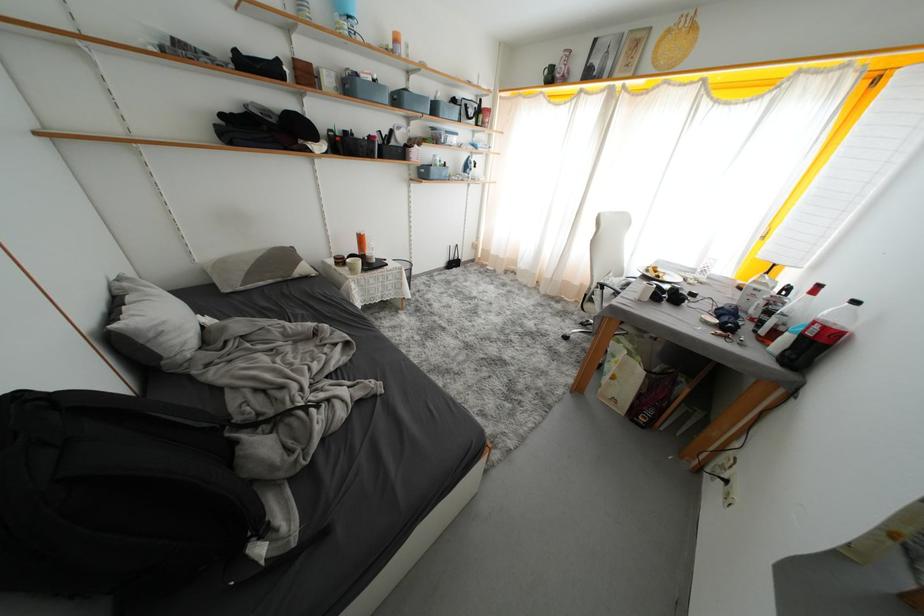
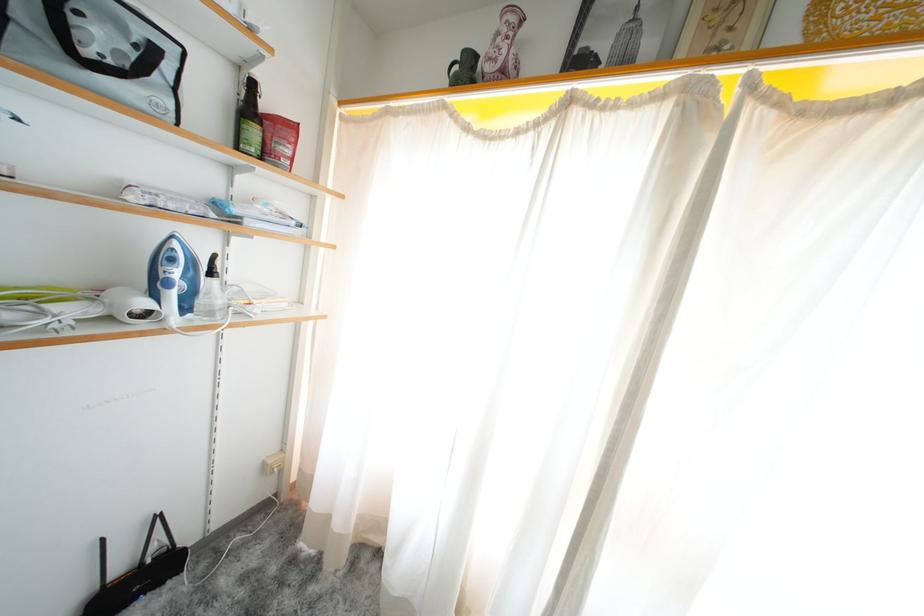
Where in the second image is the point corresponding to point 487,122 from the first image?

(261, 137)